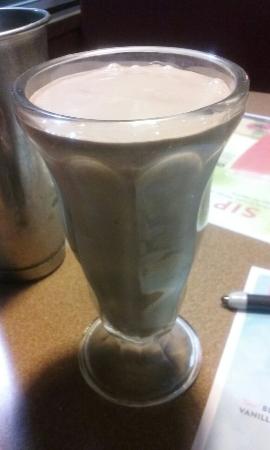
I want to click on 1 black bench, so click(x=237, y=39).